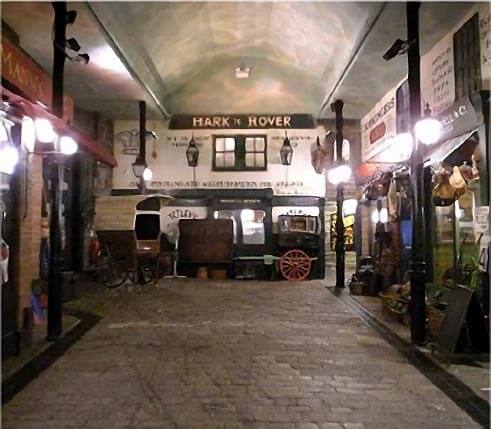
Where is `white painted writing above set of windows`? The height and width of the screenshot is (429, 491). white painted writing above set of windows is located at coordinates (276, 119), (232, 123), (222, 121).